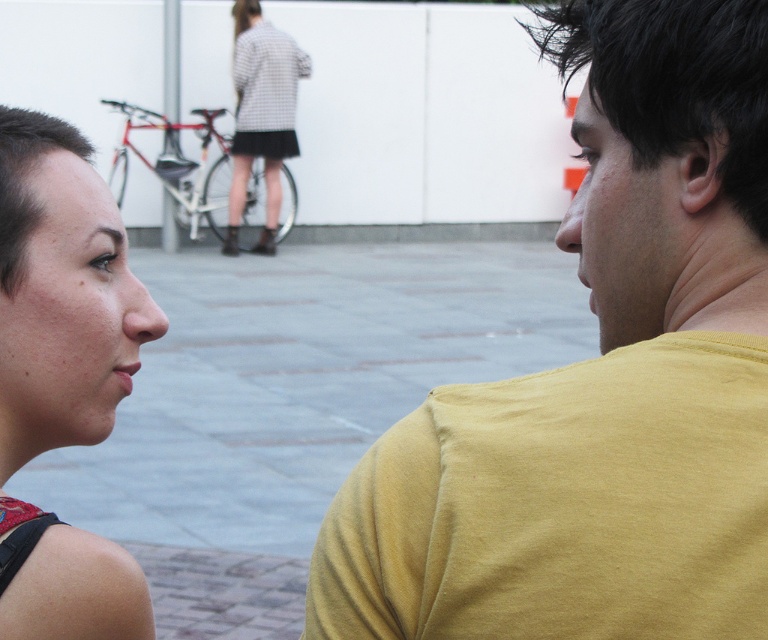
Question: Which point is closer to the camera?

Choices:
 (A) (227, 246)
 (B) (40, 563)
 (C) (371, 522)

Answer: (C)

Question: Is yellow cotton t-shirt at right bigger than checkered fabric dress at upper center?

Choices:
 (A) yes
 (B) no

Answer: (B)

Question: Which of the following is the closest to the observer?

Choices:
 (A) 762,481
 (B) 237,17

Answer: (A)

Question: Does yellow cotton t-shirt at right have a smaller size compared to matte black hair at left?

Choices:
 (A) yes
 (B) no

Answer: (B)

Question: Which is farther from the matte black hair at left?

Choices:
 (A) yellow cotton t-shirt at right
 (B) checkered fabric dress at upper center

Answer: (B)

Question: Where is yellow cotton t-shirt at right located in relation to matte black hair at left in the image?

Choices:
 (A) below
 (B) above

Answer: (B)